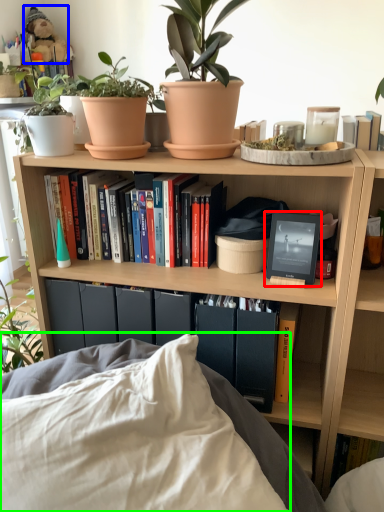
Question: Considering the real-world distances, which object is farthest from picture frame (highlighted by a red box)? toy (highlighted by a blue box) or pillow (highlighted by a green box)?

Choices:
 (A) toy
 (B) pillow

Answer: (A)